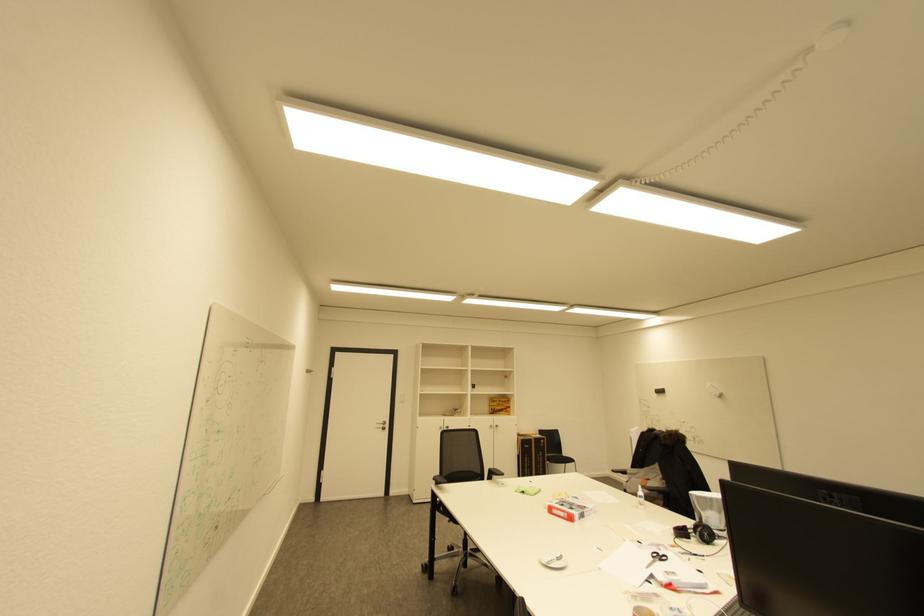
Find the location of `black chair armrest`. black chair armrest is located at coordinates (494, 472).